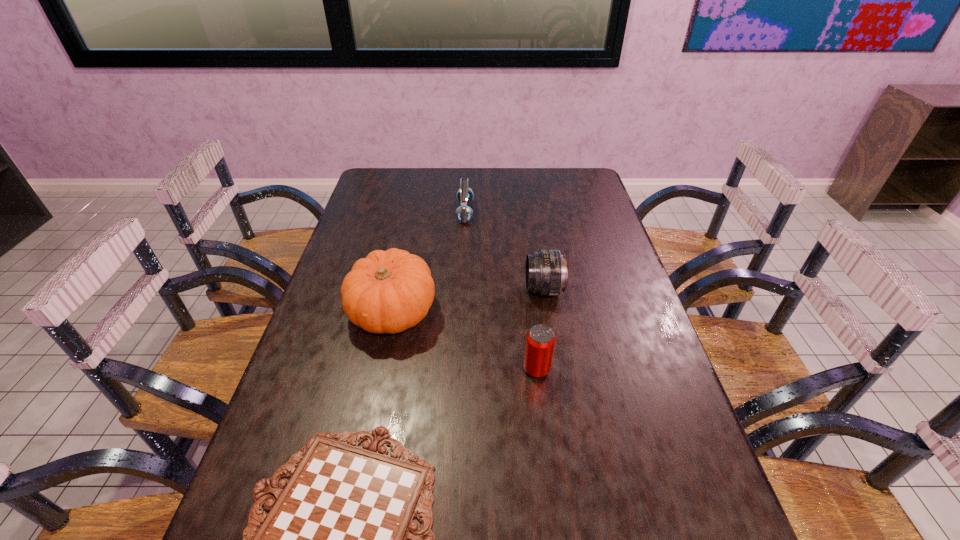
The height and width of the screenshot is (540, 960). Identify the location of object located at the left edge. (389, 291).

Identify the location of blank area at the far edge. This screenshot has width=960, height=540. (450, 178).

This screenshot has width=960, height=540. In the image, there is a desktop. Find the location of `vacant area at the left edge`. vacant area at the left edge is located at coordinates (376, 206).

The width and height of the screenshot is (960, 540). I want to click on vacant space at the right edge of the desktop, so click(x=605, y=222).

Where is `blank space at the far left corner of the desktop`? Image resolution: width=960 pixels, height=540 pixels. blank space at the far left corner of the desktop is located at coordinates (407, 183).

I want to click on vacant area at the far right corner, so click(x=562, y=181).

Where is `free space between the telephoto lens and the farthest object`? The width and height of the screenshot is (960, 540). free space between the telephoto lens and the farthest object is located at coordinates (504, 251).

Find the location of a particular element. The height and width of the screenshot is (540, 960). free space between the telephoto lens and the farthest object is located at coordinates (504, 251).

The image size is (960, 540). What are the coordinates of `free space between the fourth farthest object and the tallest object` in the screenshot? It's located at (465, 340).

Identify the location of free space between the pumpkin and the telephoto lens. (468, 301).